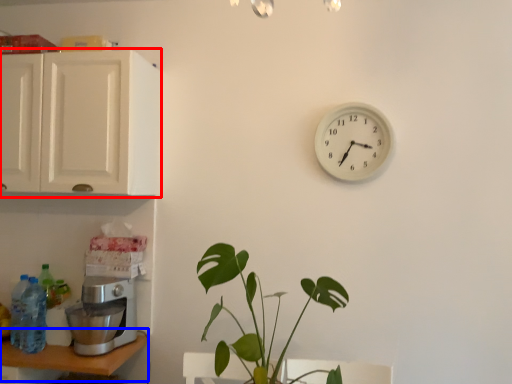
Question: Which object is further to the camera taking this photo, cabinetry (highlighted by a red box) or table (highlighted by a blue box)?

Choices:
 (A) cabinetry
 (B) table

Answer: (A)